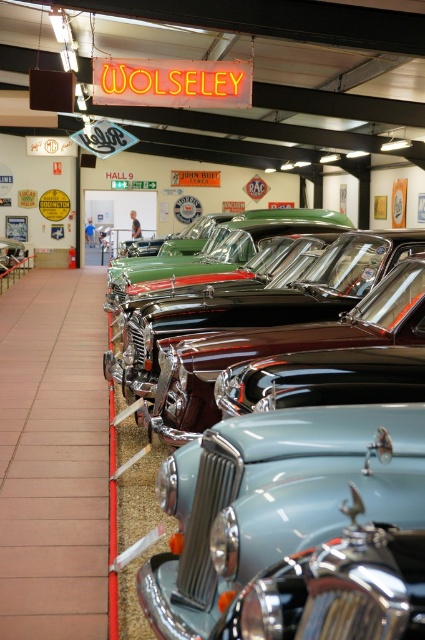
Does satin teal car at center have a smaller size compared to light blue metallic car at center?

No.

What do you see at coordinates (275, 499) in the screenshot? I see `satin teal car at center` at bounding box center [275, 499].

Is point (226, 541) behind point (146, 324)?

That is False.

Identify the location of satin teal car at center. The width and height of the screenshot is (425, 640). (275, 499).